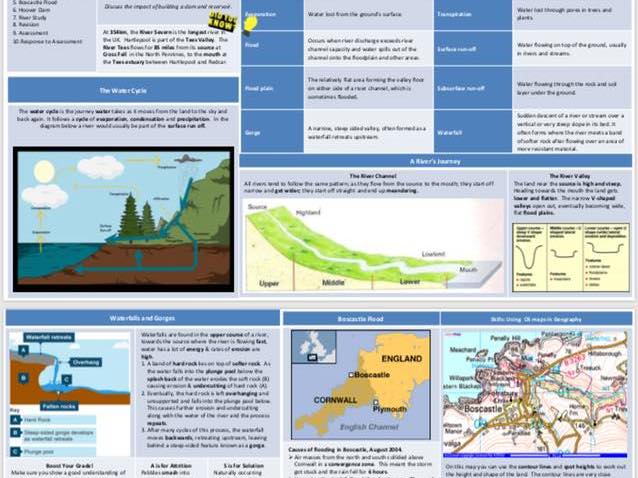
Locate an element on the screen. The height and width of the screenshot is (478, 638). bright blue bar is located at coordinates (517, 453).